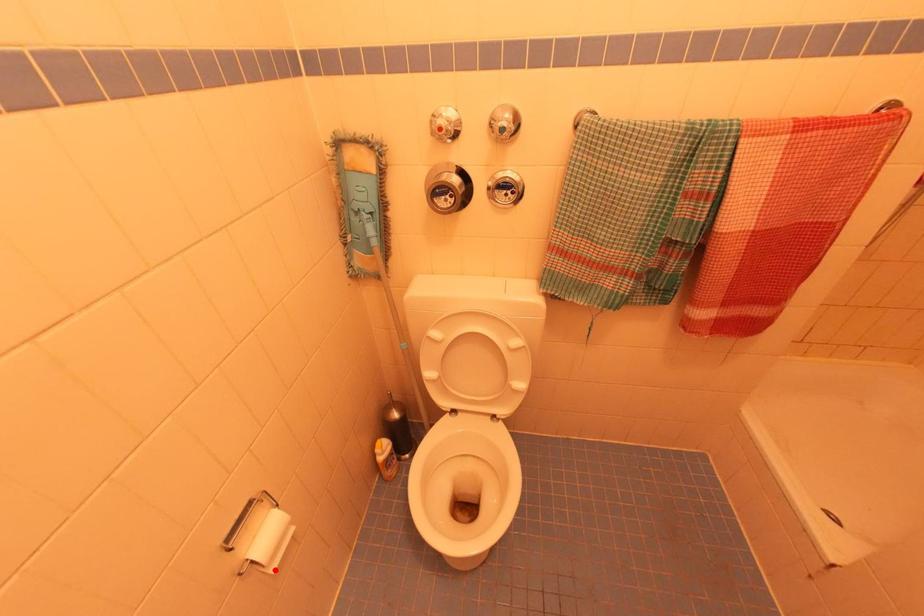
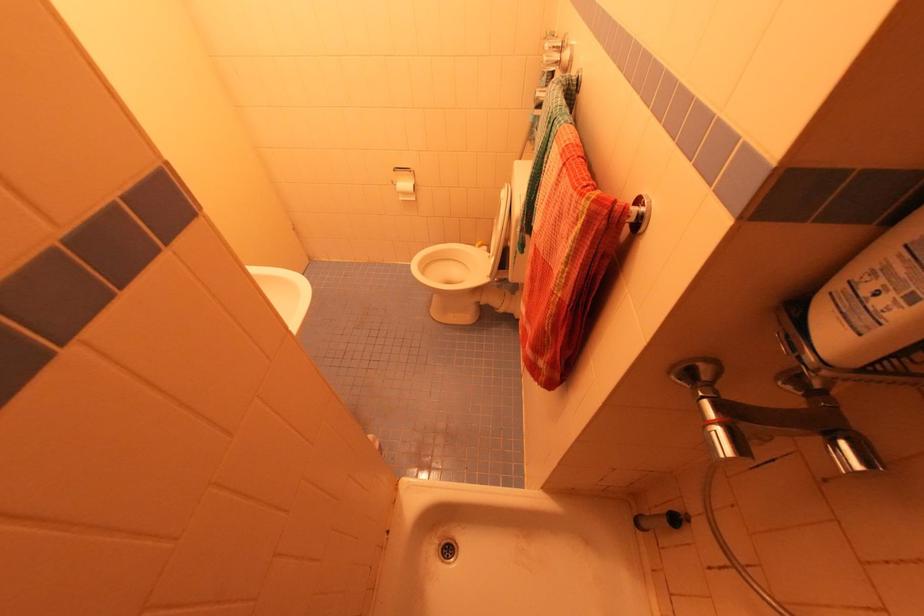
Locate, in the second image, the point that corresponds to the highlighted location in the first image.

(403, 200)